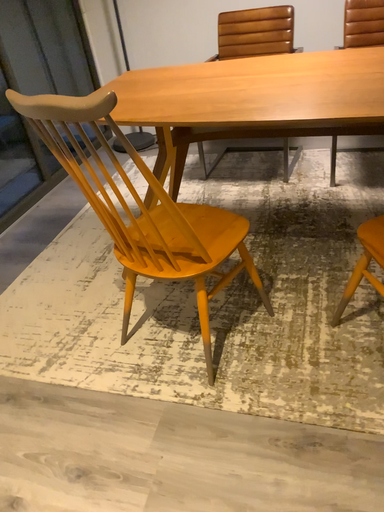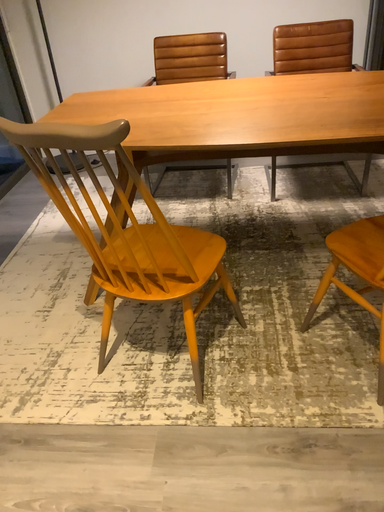
Question: Which way did the camera rotate in the video?

Choices:
 (A) rotated left
 (B) rotated right

Answer: (B)